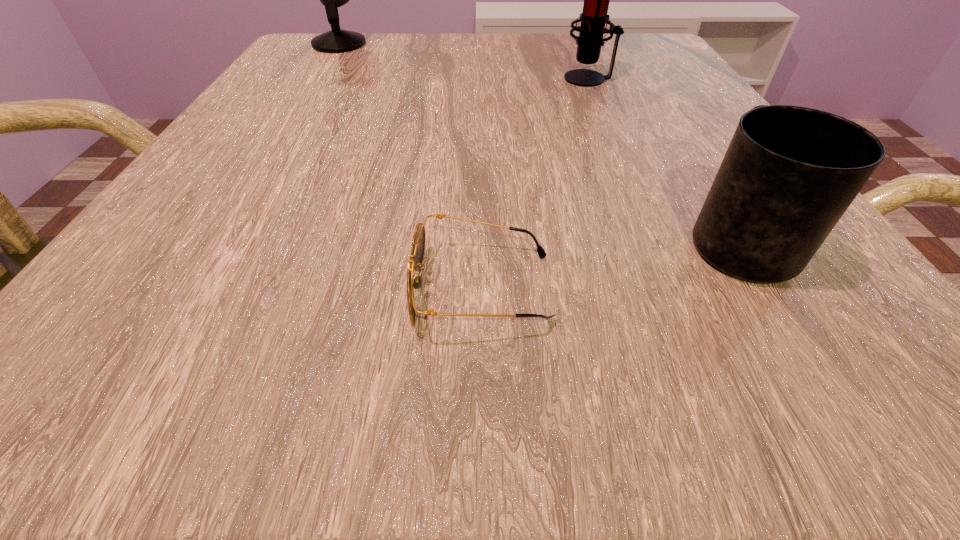
This screenshot has height=540, width=960. What are the coordinates of `the leftmost object` in the screenshot? It's located at (336, 40).

Find the location of a particular element. Image resolution: width=960 pixels, height=540 pixels. the farther microphone is located at coordinates (336, 40).

The height and width of the screenshot is (540, 960). In order to click on the nearer microphone in this screenshot , I will do `click(593, 18)`.

I want to click on the second farthest object, so click(x=593, y=18).

Image resolution: width=960 pixels, height=540 pixels. I want to click on the third tallest object, so click(x=789, y=174).

The width and height of the screenshot is (960, 540). Identify the location of sunglasses. click(x=418, y=244).

You are a GUI agent. You are given a task and a screenshot of the screen. Output one action in this format:
    pyautogui.click(x=<x>, y=<y>)
    Task: Click on the shortest object
    The height and width of the screenshot is (540, 960).
    Given the screenshot: What is the action you would take?
    pyautogui.click(x=418, y=244)

Locate an element on the screen. vacant space situated 0.180m on the stand of the farthest object is located at coordinates (451, 44).

Find the location of a particular element. vacant region located 0.060m on the right of the right microphone is located at coordinates (646, 78).

This screenshot has width=960, height=540. In order to click on vacant space situated 0.260m on the side of the second shortest object with the handle in this screenshot , I will do `click(656, 105)`.